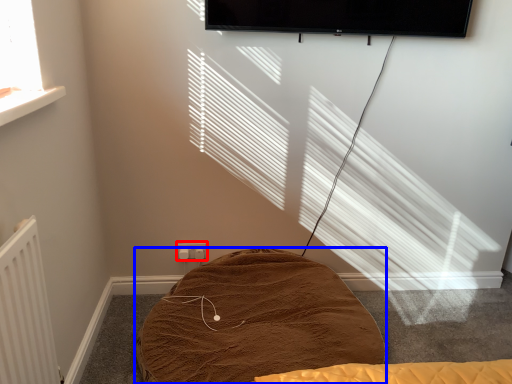
Question: Which object appears closest to the camera in this image, electric outlet (highlighted by a red box) or furniture (highlighted by a blue box)?

Choices:
 (A) electric outlet
 (B) furniture

Answer: (B)